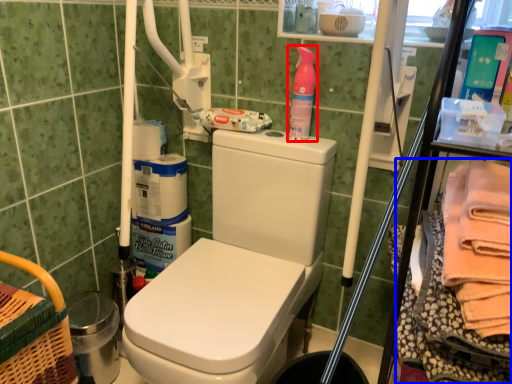
Question: Which object appears closest to the camera in this image, cleaning product (highlighted by a red box) or material (highlighted by a blue box)?

Choices:
 (A) cleaning product
 (B) material

Answer: (B)